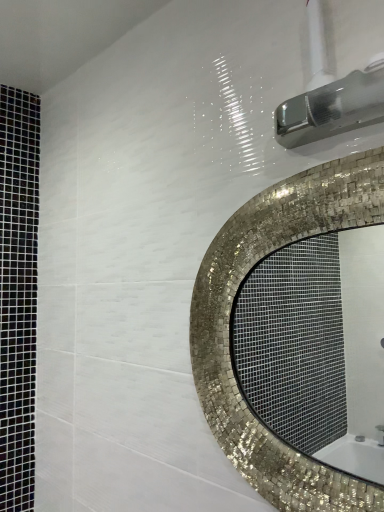
The width and height of the screenshot is (384, 512). What do you see at coordinates (333, 106) in the screenshot?
I see `brushed metal showerhead at upper right` at bounding box center [333, 106].

Find the location of a particular element. The height and width of the screenshot is (512, 384). brushed metal showerhead at upper right is located at coordinates (333, 106).

The height and width of the screenshot is (512, 384). Describe the element at coordinates (317, 346) in the screenshot. I see `mosaic tile mirror at center` at that location.

Where is `mosaic tile mirror at center`? Image resolution: width=384 pixels, height=512 pixels. mosaic tile mirror at center is located at coordinates (317, 346).

You are a GUI agent. You are given a task and a screenshot of the screen. Output one action in this format:
    pyautogui.click(x=<x>, y=<y>)
    Task: Click on the brushed metal showerhead at upper right
    Image resolution: width=384 pixels, height=512 pixels.
    Given the screenshot: What is the action you would take?
    click(x=333, y=106)

Considering the relative positions of mosaic tile mirror at center and brushed metal showerhead at upper right in the image provided, is mosaic tile mirror at center to the left of brushed metal showerhead at upper right from the viewer's perspective?

Yes.

Relative to brushed metal showerhead at upper right, is mosaic tile mirror at center in front or behind?

Visually, mosaic tile mirror at center is located behind brushed metal showerhead at upper right.

Is point (351, 234) closer to viewer compared to point (365, 104)?

No, it is not.

From the image's perspective, between mosaic tile mirror at center and brushed metal showerhead at upper right, which one is located above?

brushed metal showerhead at upper right, from the image's perspective.

From a real-world perspective, does mosaic tile mirror at center sit lower than brushed metal showerhead at upper right?

Correct, in the physical world, mosaic tile mirror at center is lower than brushed metal showerhead at upper right.

Considering the sizes of objects mosaic tile mirror at center and brushed metal showerhead at upper right in the image provided, who is thinner, mosaic tile mirror at center or brushed metal showerhead at upper right?

Thinner between the two is mosaic tile mirror at center.

Who is shorter, mosaic tile mirror at center or brushed metal showerhead at upper right?

brushed metal showerhead at upper right is shorter.

Considering the sizes of mosaic tile mirror at center and brushed metal showerhead at upper right in the image, is mosaic tile mirror at center bigger or smaller than brushed metal showerhead at upper right?

In the image, mosaic tile mirror at center appears to be larger than brushed metal showerhead at upper right.

Is mosaic tile mirror at center spatially inside brushed metal showerhead at upper right, or outside of it?

mosaic tile mirror at center is not inside brushed metal showerhead at upper right, it's outside.

Are mosaic tile mirror at center and brushed metal showerhead at upper right located far from each other?

Yes, mosaic tile mirror at center and brushed metal showerhead at upper right are located far from each other.

Is mosaic tile mirror at center positioned with its back to brushed metal showerhead at upper right?

That's not correct — mosaic tile mirror at center is not looking away from brushed metal showerhead at upper right.

Can you tell me how much mosaic tile mirror at center and brushed metal showerhead at upper right differ in facing direction?

The facing directions of mosaic tile mirror at center and brushed metal showerhead at upper right are 0.00223 degrees apart.

Where is `shower positioned vertically above the mosaic tile mirror at center (from a real-world perspective)`? The image size is (384, 512). shower positioned vertically above the mosaic tile mirror at center (from a real-world perspective) is located at coordinates (333, 106).

Is brushed metal showerhead at upper right to the left of mosaic tile mirror at center from the viewer's perspective?

No, brushed metal showerhead at upper right is not to the left of mosaic tile mirror at center.

Is brushed metal showerhead at upper right in front of or behind mosaic tile mirror at center in the image?

brushed metal showerhead at upper right is in front of mosaic tile mirror at center.

Is point (377, 80) closer or farther from the camera than point (245, 390)?

Point (377, 80) appears to be closer to the viewer than point (245, 390).

From the image's perspective, who appears lower, brushed metal showerhead at upper right or mosaic tile mirror at center?

mosaic tile mirror at center, from the image's perspective.

From a real-world perspective, is brushed metal showerhead at upper right on mosaic tile mirror at center?

Yes, from a real-world perspective, brushed metal showerhead at upper right is above mosaic tile mirror at center.

Is brushed metal showerhead at upper right thinner than mosaic tile mirror at center?

No, brushed metal showerhead at upper right is not thinner than mosaic tile mirror at center.

Between brushed metal showerhead at upper right and mosaic tile mirror at center, which one has more height?

With more height is mosaic tile mirror at center.

In the scene shown: Is brushed metal showerhead at upper right smaller than mosaic tile mirror at center?

Yes.

Choose the correct answer: Is brushed metal showerhead at upper right inside mosaic tile mirror at center or outside it?

brushed metal showerhead at upper right is outside mosaic tile mirror at center.

Does brushed metal showerhead at upper right touch mosaic tile mirror at center?

No, brushed metal showerhead at upper right is not beside mosaic tile mirror at center.

Is brushed metal showerhead at upper right turned away from mosaic tile mirror at center?

No, brushed metal showerhead at upper right is not facing the opposite direction of mosaic tile mirror at center.

How much distance is there between brushed metal showerhead at upper right and mosaic tile mirror at center?

They are 2.09 meters apart.

In order to click on shower on the right of mosaic tile mirror at center in this screenshot , I will do `click(333, 106)`.

The width and height of the screenshot is (384, 512). Find the location of `shower above the mosaic tile mirror at center (from a real-world perspective)`. shower above the mosaic tile mirror at center (from a real-world perspective) is located at coordinates (333, 106).

I want to click on shower that appears above the mosaic tile mirror at center (from the image's perspective), so click(333, 106).